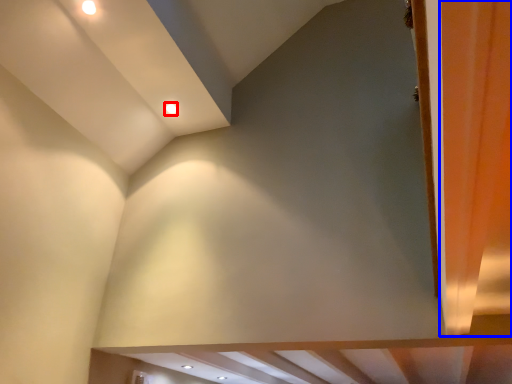
Question: Among these objects, which one is nearest to the camera, lighting (highlighted by a red box) or curtain (highlighted by a blue box)?

Choices:
 (A) lighting
 (B) curtain

Answer: (B)